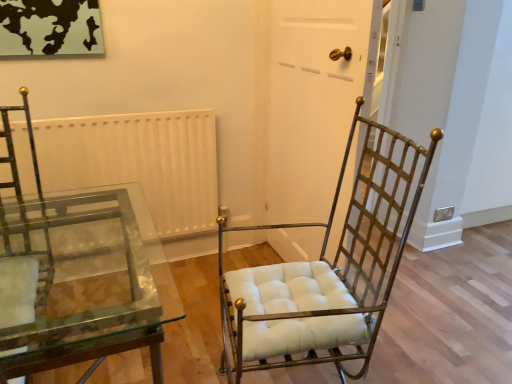
Find the location of a particular element. The width and height of the screenshot is (512, 384). free spot above white matte radiator at upper center (from a real-world perspective) is located at coordinates pos(94,118).